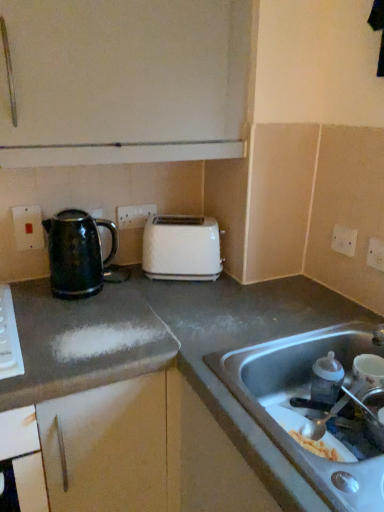
This screenshot has height=512, width=384. Find the location of `vacant point to the left of white plastic toaster at center`. vacant point to the left of white plastic toaster at center is located at coordinates (129, 276).